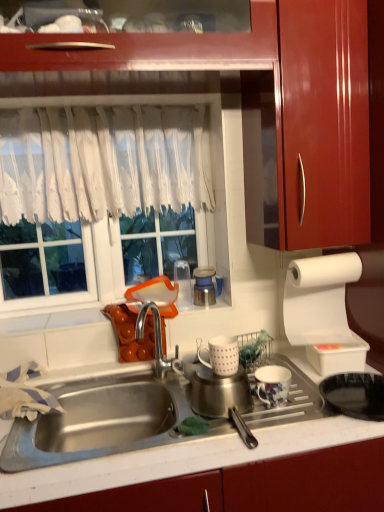
This screenshot has width=384, height=512. In order to click on white paper at right in this screenshot , I will do `click(319, 298)`.

At what (x,y) coordinates should I click in order to perform the action: click on white plastic container at right, marked as the 1th appliance in a right-to-left arrangement. Please return your answer as a coordinate pair (x, y). Image resolution: width=384 pixels, height=512 pixels. Looking at the image, I should click on (338, 356).

What is the approximate width of black matte frying pan at lower right?

10.88 inches.

Locate an element on the screen. This screenshot has height=512, width=384. black matte frying pan at lower right is located at coordinates (355, 394).

Image resolution: width=384 pixels, height=512 pixels. What do you see at coordinates (273, 384) in the screenshot?
I see `floral ceramic mug at lower center, the 1th tableware from the bottom` at bounding box center [273, 384].

Find the location of `white lace curtain at upper center`. white lace curtain at upper center is located at coordinates (119, 183).

This screenshot has height=512, width=384. In order to click on metallic blue thermos at center, the second appliance positioned from the bottom in this screenshot , I will do `click(204, 286)`.

Image resolution: width=384 pixels, height=512 pixels. What do you see at coordinates (221, 355) in the screenshot?
I see `white matte mug at center, the 2th tableware in the right-to-left sequence` at bounding box center [221, 355].

At what (x,y) coordinates should I click in order to perform the action: click on white paper at right. Please return your answer as a coordinate pair (x, y). The image size is (384, 512). Looking at the image, I should click on (319, 298).

Is glossy wood cabinet at upper right facing towards white lace curtain at upper center?

Yes, glossy wood cabinet at upper right is turned towards white lace curtain at upper center.

Would you consider glossy wood cabinet at upper right to be distant from white lace curtain at upper center?

Actually, glossy wood cabinet at upper right and white lace curtain at upper center are a little close together.

Considering the relative sizes of glossy wood cabinet at upper right and white lace curtain at upper center in the image provided, is glossy wood cabinet at upper right taller than white lace curtain at upper center?

Correct, glossy wood cabinet at upper right is much taller as white lace curtain at upper center.

Based on their sizes in the image, would you say glossy wood cabinet at upper right is bigger or smaller than white lace curtain at upper center?

Considering their sizes, glossy wood cabinet at upper right takes up more space than white lace curtain at upper center.

Which point is more forward, (99, 193) or (229, 348)?

Positioned in front is point (229, 348).

Is white lace curtain at upper center further to the viewer compared to white matte mug at center, the 2th tableware in the right-to-left sequence?

Yes, white lace curtain at upper center is further from the viewer.

Which object is wider, white lace curtain at upper center or white matte mug at center, which is the second tableware from bottom to top?

With larger width is white lace curtain at upper center.

Considering the sizes of white lace curtain at upper center and white matte mug at center, which is the second tableware from bottom to top, in the image, is white lace curtain at upper center bigger or smaller than white matte mug at center, which is the second tableware from bottom to top,?

white lace curtain at upper center is bigger than white matte mug at center, which is the second tableware from bottom to top.

In the scene shown: Is floral ceramic mug at lower center, placed as the first tableware when sorted from right to left, beside white matte mug at center, which is the second tableware from bottom to top?

No.

From the picture: Is floral ceramic mug at lower center, the 2th tableware in the top-to-bottom sequence, aimed at white matte mug at center, the first tableware from the left?

No, floral ceramic mug at lower center, the 2th tableware in the top-to-bottom sequence, is not turned towards white matte mug at center, the first tableware from the left.

From the image's perspective, is floral ceramic mug at lower center, placed as the first tableware when sorted from right to left, located above white matte mug at center, the first tableware from the left?

No, from the image's perspective, floral ceramic mug at lower center, placed as the first tableware when sorted from right to left, is not above white matte mug at center, the first tableware from the left.

This screenshot has width=384, height=512. In order to click on tableware below the white matte mug at center, the 2th tableware in the right-to-left sequence (from the image's perspective) in this screenshot , I will do `click(273, 384)`.

Is white lace curtain at upper center at the right side of white paper at right?

Incorrect, white lace curtain at upper center is not on the right side of white paper at right.

Locate an element on the screen. This screenshot has width=384, height=512. window screen that is above the white paper at right (from a real-world perspective) is located at coordinates (119, 183).

Looking at this image, from a real-world perspective, is white lace curtain at upper center located beneath white paper at right?

No, from a real-world perspective, white lace curtain at upper center is not beneath white paper at right.

Is white lace curtain at upper center positioned with its back to white paper at right?

No, white paper at right is not at the back of white lace curtain at upper center.

Identify the location of curtain behind the white paper at right. This screenshot has height=512, width=384. (102, 162).

Between point (69, 163) and point (286, 319), which one is positioned in front?

The point (286, 319) is closer.

Is white lace curtain at upper center not close to white paper at right?

No, white lace curtain at upper center is in close proximity to white paper at right.

Is metallic blue thermos at center, placed as the second appliance when sorted from front to back, situated inside white paper at right or outside?

metallic blue thermos at center, placed as the second appliance when sorted from front to back, is located beyond the bounds of white paper at right.

From the image's perspective, between metallic blue thermos at center, which is the 2th appliance in right-to-left order, and white paper at right, which one is located above?

From the image's view, metallic blue thermos at center, which is the 2th appliance in right-to-left order, is above.

Between metallic blue thermos at center, placed as the second appliance when sorted from front to back, and white paper at right, which one has less height?

With less height is metallic blue thermos at center, placed as the second appliance when sorted from front to back.

Is point (205, 305) more distant than point (328, 290)?

Yes, it is.

Is white lace curtain at upper center to the right of floral ceramic mug at lower center, the 2th tableware in the top-to-bottom sequence, from the viewer's perspective?

No.

From a real-world perspective, is white lace curtain at upper center physically located above or below floral ceramic mug at lower center, the 1th tableware from the bottom?

In terms of real-world spatial position, white lace curtain at upper center is above floral ceramic mug at lower center, the 1th tableware from the bottom.

Which is less distant, [9,173] or [284,371]?

Point [9,173] appears to be farther away from the viewer than point [284,371].

The height and width of the screenshot is (512, 384). Identify the location of cabinetry above the white lace curtain at upper center (from the image's perspective). (276, 104).

From a real-world perspective, which tableware is the 1st one underneath the white lace curtain at upper center? Please provide its 2D coordinates.

[(221, 355)]

Which object lies further to the anchor point white matte mug at center, placed as the first tableware when sorted from top to bottom, black matte frying pan at lower right or metallic blue thermos at center, which is the 2th appliance in right-to-left order?

metallic blue thermos at center, which is the 2th appliance in right-to-left order, is positioned further to the anchor white matte mug at center, placed as the first tableware when sorted from top to bottom.

Considering their positions, is metallic blue thermos at center, which is the 2th appliance in right-to-left order, positioned closer to black matte frying pan at lower right than glossy wood cabinet at upper right?

metallic blue thermos at center, which is the 2th appliance in right-to-left order, is closer to black matte frying pan at lower right.

When comparing their distances from white paper at right, does metallic blue thermos at center, the second appliance positioned from the bottom, or white lace curtain at upper center seem closer?

metallic blue thermos at center, the second appliance positioned from the bottom, is closer to white paper at right.

Which object lies nearer to the anchor point black matte frying pan at lower right, white matte mug at center, the first tableware from the left, or glossy wood cabinet at upper right?

white matte mug at center, the first tableware from the left, lies closer to black matte frying pan at lower right than the other object.

When comparing their distances from glossy wood cabinet at upper right, does floral ceramic mug at lower center, acting as the second tableware starting from the left, or metallic blue thermos at center, which ranks as the first appliance in back-to-front order, seem further?

Based on the image, floral ceramic mug at lower center, acting as the second tableware starting from the left, appears to be further to glossy wood cabinet at upper right.

From the picture: Looking at the image, which one is located closer to floral ceramic mug at lower center, the 2th tableware in the top-to-bottom sequence, white matte mug at center, which is the second tableware from bottom to top, or white plastic container at right, which appears as the 2th appliance when viewed from the left?

Result: Based on the image, white matte mug at center, which is the second tableware from bottom to top, appears to be nearer to floral ceramic mug at lower center, the 2th tableware in the top-to-bottom sequence.

Estimate the real-world distances between objects in this image. Which object is closer to white lace curtain at upper center, black matte frying pan at lower right or floral ceramic mug at lower center, placed as the first tableware when sorted from right to left?

floral ceramic mug at lower center, placed as the first tableware when sorted from right to left, is closer to white lace curtain at upper center.

From the image, which object appears to be farther from metallic blue thermos at center, the second appliance positioned from the bottom, floral ceramic mug at lower center, acting as the second tableware starting from the left, or glossy wood cabinet at upper right?

glossy wood cabinet at upper right.

Identify the location of appliance between black matte frying pan at lower right and metallic blue thermos at center, which ranks as the first appliance in back-to-front order, in the front-back direction. Image resolution: width=384 pixels, height=512 pixels. (338, 356).

Find the location of `tableware between floral ceramic mug at lower center, placed as the first tableware when sorted from right to left, and metallic blue thermos at center, which is the 2th appliance in right-to-left order, from front to back`. tableware between floral ceramic mug at lower center, placed as the first tableware when sorted from right to left, and metallic blue thermos at center, which is the 2th appliance in right-to-left order, from front to back is located at coordinates (221, 355).

Image resolution: width=384 pixels, height=512 pixels. I want to click on appliance positioned between floral ceramic mug at lower center, acting as the second tableware starting from the left, and metallic blue thermos at center, the second appliance positioned from the bottom, from near to far, so click(338, 356).

Find the location of `paper towel between white lace curtain at upper center and black matte frying pan at lower right`. paper towel between white lace curtain at upper center and black matte frying pan at lower right is located at coordinates click(x=319, y=298).